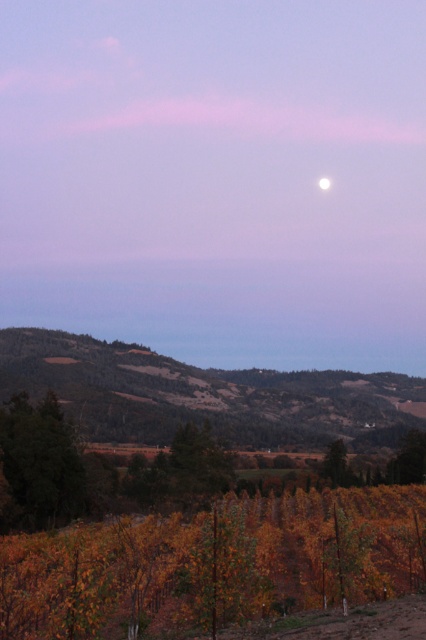
Does green grassy hillside at lower center appear under green matte tree at lower left?

No.

Based on the photo, is green grassy hillside at lower center to the right of green matte tree at lower left from the viewer's perspective?

Yes, green grassy hillside at lower center is to the right of green matte tree at lower left.

Does point (51, 365) lie behind point (78, 467)?

Yes, it is.

Identify the location of green grassy hillside at lower center. The image size is (426, 640). (206, 396).

Is green grassy hillside at lower center closer to camera compared to green matte tree at center?

Yes, it is.

The width and height of the screenshot is (426, 640). What do you see at coordinates (206, 396) in the screenshot?
I see `green grassy hillside at lower center` at bounding box center [206, 396].

Identify the location of green grassy hillside at lower center. (206, 396).

Does point (344, 454) lie behind point (322, 177)?

No.

Which is in front, point (351, 480) or point (322, 186)?

Positioned in front is point (351, 480).

Identify the location of green matte tree at center. (337, 465).